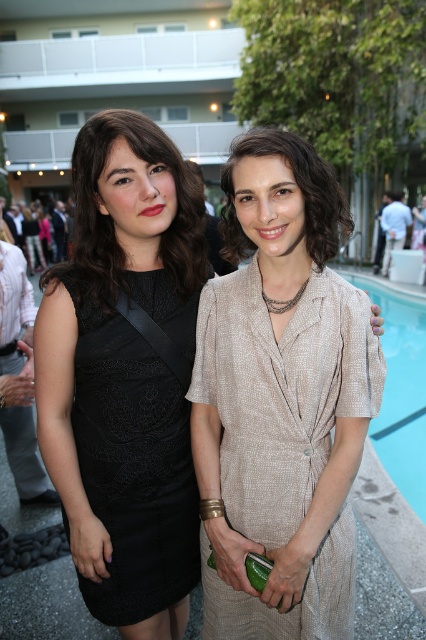
Does point (321, 211) come behind point (382, 426)?

No, it is not.

Which is above, black satin dress at center or blue smooth water at lower right?

blue smooth water at lower right

Which is in front, point (293, 246) or point (394, 362)?

Point (293, 246) is more forward.

Find the location of a particular element. This screenshot has width=426, height=640. black satin dress at center is located at coordinates (134, 205).

Can you confirm if beige textured dress at center is positioned below blue smooth water at lower right?

Indeed, beige textured dress at center is positioned under blue smooth water at lower right.

Based on the photo, how distant is beige textured dress at center from blue smooth water at lower right?

A distance of 1.25 meters exists between beige textured dress at center and blue smooth water at lower right.

Where is `beige textured dress at center`? The width and height of the screenshot is (426, 640). beige textured dress at center is located at coordinates (281, 392).

Can you confirm if black lace dress at left is shorter than matte beige dress at center?

No, black lace dress at left is not shorter than matte beige dress at center.

Is black lace dress at left further to camera compared to matte beige dress at center?

Yes, it is behind matte beige dress at center.

You are a GUI agent. You are given a task and a screenshot of the screen. Output one action in this format:
    pyautogui.click(x=<x>, y=<y>)
    Task: Click on the black lace dress at left
    This screenshot has width=426, height=640.
    Given the screenshot: What is the action you would take?
    pyautogui.click(x=132, y=461)